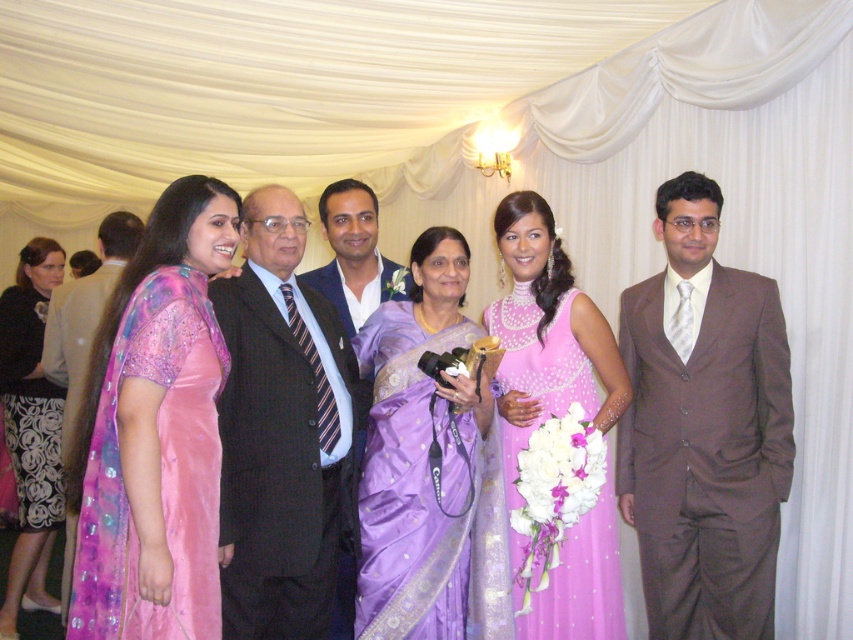
Which of these two, brown satin suit at right or shiny black suit at left, stands shorter?

shiny black suit at left

Can you confirm if brown satin suit at right is shorter than shiny black suit at left?

No, brown satin suit at right is not shorter than shiny black suit at left.

Is point (724, 372) less distant than point (90, 308)?

Yes, it is in front of point (90, 308).

In order to click on brown satin suit at right in this screenshot , I will do `click(703, 428)`.

Does brown satin suit at right appear on the right side of purple satin saree at center?

Yes, brown satin suit at right is to the right of purple satin saree at center.

What do you see at coordinates (703, 428) in the screenshot? I see `brown satin suit at right` at bounding box center [703, 428].

In order to click on brown satin suit at right in this screenshot , I will do `click(703, 428)`.

Can you confirm if pink satin dress at center is smaller than black textured sweater at lower left?

Yes.

Which is more to the right, pink satin dress at center or black textured sweater at lower left?

Positioned to the right is pink satin dress at center.

Does point (605, 380) come closer to viewer compared to point (28, 588)?

That is True.

Find the location of a particular element. pink satin dress at center is located at coordinates (546, 333).